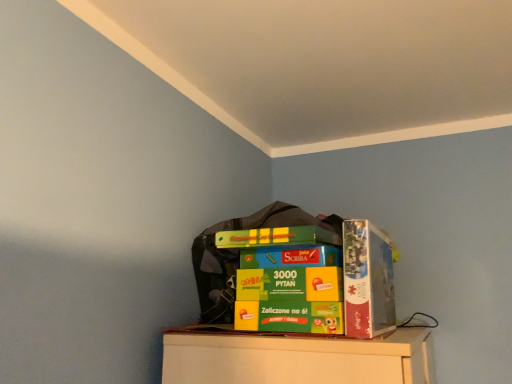
Where is `matte cardboard box at upper right`? This screenshot has height=384, width=512. matte cardboard box at upper right is located at coordinates (367, 280).

Measure the distance between matte cardboard box at upper right and camera.

The depth of matte cardboard box at upper right is 38.14 inches.

Describe the element at coordinates (367, 280) in the screenshot. I see `matte cardboard box at upper right` at that location.

The width and height of the screenshot is (512, 384). Describe the element at coordinates (239, 254) in the screenshot. I see `green cardboard box at upper center` at that location.

The image size is (512, 384). Identify the location of green cardboard box at upper center. (239, 254).

Measure the distance between green cardboard box at upper center and camera.

green cardboard box at upper center and camera are 1.15 meters apart from each other.

Find the location of a particular element. matte cardboard box at upper right is located at coordinates (367, 280).

Visually, is green cardboard box at upper center positioned to the left or to the right of matte cardboard box at upper right?

In the image, green cardboard box at upper center appears on the left side of matte cardboard box at upper right.

Considering the positions of objects green cardboard box at upper center and matte cardboard box at upper right in the image provided, who is behind, green cardboard box at upper center or matte cardboard box at upper right?

matte cardboard box at upper right is further away from the camera.

Does point (331, 229) come farther from viewer compared to point (377, 268)?

Yes, point (331, 229) is farther from viewer.

From the image's perspective, would you say green cardboard box at upper center is positioned over matte cardboard box at upper right?

No, from the image's perspective, green cardboard box at upper center is not above matte cardboard box at upper right.

From a real-world perspective, who is located lower, green cardboard box at upper center or matte cardboard box at upper right?

green cardboard box at upper center, from a real-world perspective.

Considering the sizes of objects green cardboard box at upper center and matte cardboard box at upper right in the image provided, who is thinner, green cardboard box at upper center or matte cardboard box at upper right?

Thinner between the two is matte cardboard box at upper right.

Looking at this image, who is shorter, green cardboard box at upper center or matte cardboard box at upper right?

Standing shorter between the two is matte cardboard box at upper right.

Can you confirm if green cardboard box at upper center is smaller than matte cardboard box at upper right?

Actually, green cardboard box at upper center might be larger than matte cardboard box at upper right.

Is matte cardboard box at upper right surrounded by green cardboard box at upper center?

No, matte cardboard box at upper right is not a part of green cardboard box at upper center.

Are green cardboard box at upper center and matte cardboard box at upper right located far from each other?

green cardboard box at upper center is near matte cardboard box at upper right, not far away.

Is green cardboard box at upper center facing away from matte cardboard box at upper right?

Correct, green cardboard box at upper center is looking away from matte cardboard box at upper right.

Can you tell me how much green cardboard box at upper center and matte cardboard box at upper right differ in facing direction?

green cardboard box at upper center and matte cardboard box at upper right are facing 0.00215 degrees away from each other.

Image resolution: width=512 pixels, height=384 pixels. Find the location of `paperback book above the green cardboard box at upper center (from the image's perspective)`. paperback book above the green cardboard box at upper center (from the image's perspective) is located at coordinates (367, 280).

Considering the relative positions of matte cardboard box at upper right and green cardboard box at upper center in the image provided, is matte cardboard box at upper right to the left of green cardboard box at upper center from the viewer's perspective?

No, matte cardboard box at upper right is not to the left of green cardboard box at upper center.

In the scene shown: Is the position of matte cardboard box at upper right less distant than that of green cardboard box at upper center?

That is False.

Which is behind, point (369, 263) or point (202, 239)?

The point (202, 239) is farther from the camera.

From the image's perspective, is matte cardboard box at upper right under green cardboard box at upper center?

Incorrect, from the image's perspective, matte cardboard box at upper right is higher than green cardboard box at upper center.

From a real-world perspective, is matte cardboard box at upper right under green cardboard box at upper center?

No, from a real-world perspective, matte cardboard box at upper right is not below green cardboard box at upper center.

Considering the sizes of matte cardboard box at upper right and green cardboard box at upper center in the image, is matte cardboard box at upper right wider or thinner than green cardboard box at upper center?

matte cardboard box at upper right is thinner than green cardboard box at upper center.

Can you confirm if matte cardboard box at upper right is shorter than green cardboard box at upper center?

Yes, matte cardboard box at upper right is shorter than green cardboard box at upper center.

Between matte cardboard box at upper right and green cardboard box at upper center, which one has smaller size?

With smaller size is matte cardboard box at upper right.

Is matte cardboard box at upper right inside or outside of green cardboard box at upper center?

matte cardboard box at upper right exists outside the volume of green cardboard box at upper center.

Is matte cardboard box at upper right positioned far away from green cardboard box at upper center?

They are positioned close to each other.

Is matte cardboard box at upper right oriented towards green cardboard box at upper center?

Yes.

What's the angular difference between matte cardboard box at upper right and green cardboard box at upper center's facing directions?

The angular difference between matte cardboard box at upper right and green cardboard box at upper center is 0.00215 degrees.

The height and width of the screenshot is (384, 512). Find the location of `paperback book above the green cardboard box at upper center (from the image's perspective)`. paperback book above the green cardboard box at upper center (from the image's perspective) is located at coordinates (367, 280).

Find the location of `paperback book that appears behind the green cardboard box at upper center`. paperback book that appears behind the green cardboard box at upper center is located at coordinates (367, 280).

I want to click on collection located in front of the matte cardboard box at upper right, so click(x=239, y=254).